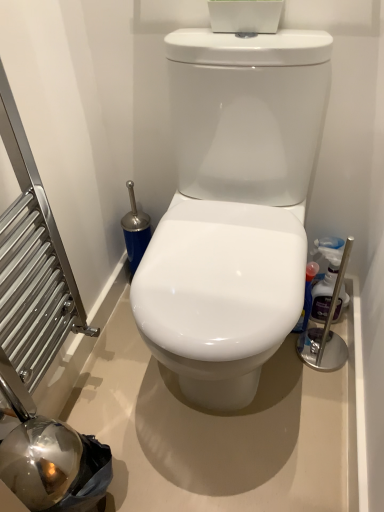
Question: Considering the relative positions of white glossy toilet at center and translucent plastic bottle at right, the 2th cleaning product when ordered from left to right, in the image provided, is white glossy toilet at center to the left or to the right of translucent plastic bottle at right, the 2th cleaning product when ordered from left to right,?

Choices:
 (A) right
 (B) left

Answer: (B)

Question: Is point (306, 96) closer or farther from the camera than point (324, 249)?

Choices:
 (A) farther
 (B) closer

Answer: (B)

Question: Which object is positioned farthest from the translucent plastic bottle at right, the 2th cleaning product when ordered from left to right?

Choices:
 (A) glossy plastic spray bottle at right, which appears as the second cleaning product when viewed from the right
 (B) white glossy toilet at center

Answer: (B)

Question: Which object is positioned closest to the white glossy toilet at center?

Choices:
 (A) glossy plastic spray bottle at right, the first cleaning product positioned from the left
 (B) translucent plastic bottle at right, the 1th cleaning product viewed from the right

Answer: (A)